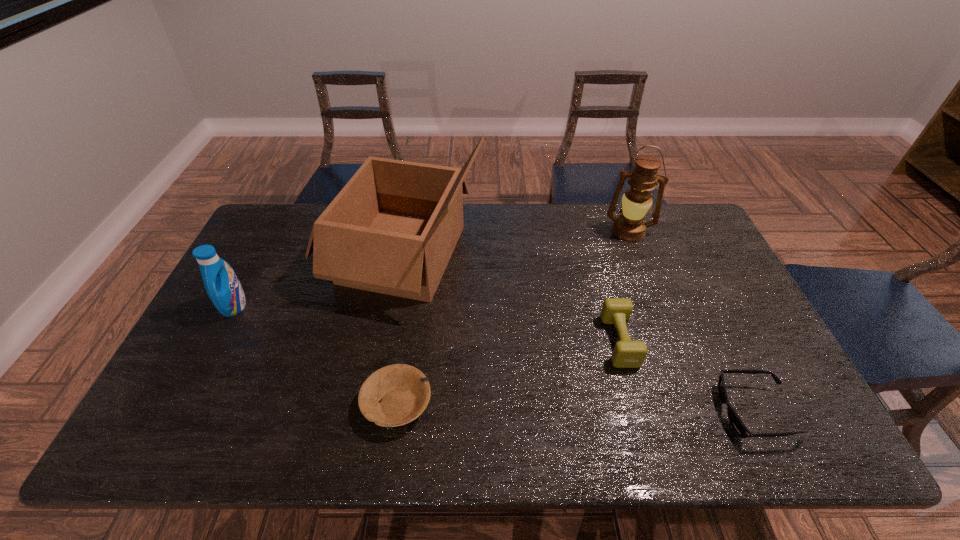
You are a GUI agent. You are given a task and a screenshot of the screen. Output one action in this format:
    pyautogui.click(x=<x>, y=<y>)
    Task: Click on the free space between the leftmost object and the sunglasses
    
    Given the screenshot: What is the action you would take?
    pyautogui.click(x=494, y=359)

Where is `vacant area between the oil lamp and the sunglasses`? The image size is (960, 540). vacant area between the oil lamp and the sunglasses is located at coordinates (691, 322).

Where is `unoccupied area between the leftmost object and the sunglasses`? unoccupied area between the leftmost object and the sunglasses is located at coordinates (494, 359).

Locate an element on the screen. empty location between the box and the sunglasses is located at coordinates (579, 333).

The image size is (960, 540). What are the coordinates of `free area in between the box and the third object from right to left` in the screenshot? It's located at (512, 297).

Where is `vacant area between the bowl and the fourth shortest object`? Image resolution: width=960 pixels, height=540 pixels. vacant area between the bowl and the fourth shortest object is located at coordinates (316, 355).

At what (x,y) coordinates should I click in order to perform the action: click on vacant point located between the box and the sunglasses. Please return your answer as a coordinate pair (x, y). The width and height of the screenshot is (960, 540). Looking at the image, I should click on [x=579, y=333].

Where is `free space between the sunglasses and the bowl`? This screenshot has width=960, height=540. free space between the sunglasses and the bowl is located at coordinates (576, 408).

Where is `free space between the oil lamp and the box`? This screenshot has height=540, width=960. free space between the oil lamp and the box is located at coordinates (516, 242).

Locate an element on the screen. Image resolution: width=960 pixels, height=540 pixels. object that ranks as the third closest to the dumbbell is located at coordinates (392, 229).